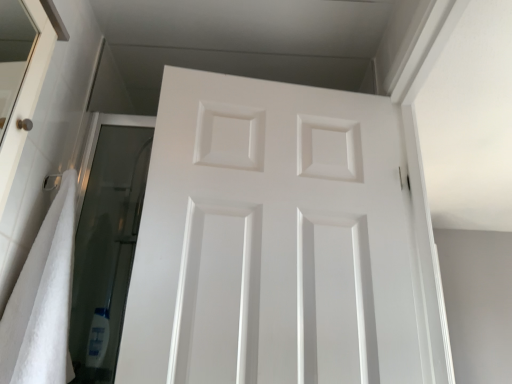
Question: Does white matte door at center have a greater height compared to white soft towel at left?

Choices:
 (A) no
 (B) yes

Answer: (B)

Question: From a real-world perspective, does white matte door at center stand above white soft towel at left?

Choices:
 (A) yes
 (B) no

Answer: (A)

Question: Is white matte door at center shorter than white soft towel at left?

Choices:
 (A) no
 (B) yes

Answer: (A)

Question: Is white matte door at center thinner than white soft towel at left?

Choices:
 (A) yes
 (B) no

Answer: (A)

Question: Is white matte door at center oriented towards white soft towel at left?

Choices:
 (A) no
 (B) yes

Answer: (A)

Question: From the image's perspective, does white matte door at center appear higher than white soft towel at left?

Choices:
 (A) no
 (B) yes

Answer: (B)

Question: From the image's perspective, is white soft towel at left beneath white matte door at center?

Choices:
 (A) yes
 (B) no

Answer: (A)

Question: Is white soft towel at left bigger than white matte door at center?

Choices:
 (A) no
 (B) yes

Answer: (A)

Question: Does white soft towel at left lie in front of white matte door at center?

Choices:
 (A) no
 (B) yes

Answer: (B)

Question: Is white soft towel at left shorter than white matte door at center?

Choices:
 (A) no
 (B) yes

Answer: (B)

Question: Is white soft towel at left oriented away from white matte door at center?

Choices:
 (A) no
 (B) yes

Answer: (A)

Question: Does white soft towel at left appear on the left side of white matte door at center?

Choices:
 (A) yes
 (B) no

Answer: (A)

Question: Choose the correct answer: Is white matte door at center inside white soft towel at left or outside it?

Choices:
 (A) inside
 (B) outside

Answer: (B)